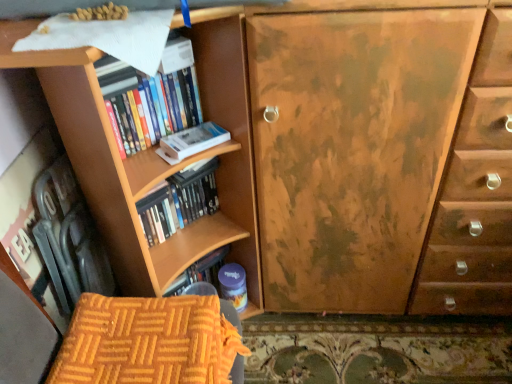
Question: Which direction should I rotate to face wooden bookshelf at center, which is the first book from bottom to top, — up or down?

Choices:
 (A) down
 (B) up

Answer: (A)

Question: Could you tell me if wooden bookshelf at center, the 2th book in the top-to-bottom sequence, is turned towards white matte paperback book at upper left?

Choices:
 (A) yes
 (B) no

Answer: (B)

Question: Does wooden bookshelf at center, which is the first book from bottom to top, contain white matte paperback book at upper left?

Choices:
 (A) no
 (B) yes

Answer: (A)

Question: Can you confirm if wooden bookshelf at center, which is the first book from bottom to top, is bigger than white matte paperback book at upper left?

Choices:
 (A) no
 (B) yes

Answer: (B)

Question: Is wooden bookshelf at center, which is the first book from bottom to top, further to the viewer compared to white matte paperback book at upper left?

Choices:
 (A) no
 (B) yes

Answer: (B)

Question: Is wooden bookshelf at center, the 2th book in the top-to-bottom sequence, at the right side of white matte paperback book at upper left?

Choices:
 (A) no
 (B) yes

Answer: (A)

Question: From a real-world perspective, does wooden bookshelf at center, the 2th book in the top-to-bottom sequence, sit lower than white matte paperback book at upper left?

Choices:
 (A) no
 (B) yes

Answer: (B)

Question: Is orange quilted fabric armchair at lower left looking in the opposite direction of wooden bookshelf at center, which is the first book from bottom to top?

Choices:
 (A) yes
 (B) no

Answer: (B)

Question: Considering the relative positions of orange quilted fabric armchair at lower left and wooden bookshelf at center, the 2th book in the top-to-bottom sequence, in the image provided, is orange quilted fabric armchair at lower left in front of wooden bookshelf at center, the 2th book in the top-to-bottom sequence,?

Choices:
 (A) no
 (B) yes

Answer: (B)

Question: Is orange quilted fabric armchair at lower left bigger than wooden bookshelf at center, which is the first book from bottom to top?

Choices:
 (A) yes
 (B) no

Answer: (B)

Question: Is orange quilted fabric armchair at lower left smaller than wooden bookshelf at center, which is the first book from bottom to top?

Choices:
 (A) no
 (B) yes

Answer: (B)

Question: Can you confirm if orange quilted fabric armchair at lower left is thinner than wooden bookshelf at center, which is the first book from bottom to top?

Choices:
 (A) yes
 (B) no

Answer: (B)

Question: From a real-world perspective, is orange quilted fabric armchair at lower left positioned under wooden bookshelf at center, the 2th book in the top-to-bottom sequence, based on gravity?

Choices:
 (A) no
 (B) yes

Answer: (B)

Question: Is white matte paperback book at upper left wider than hardcover books at left, which is the first book in top-to-bottom order?

Choices:
 (A) no
 (B) yes

Answer: (A)